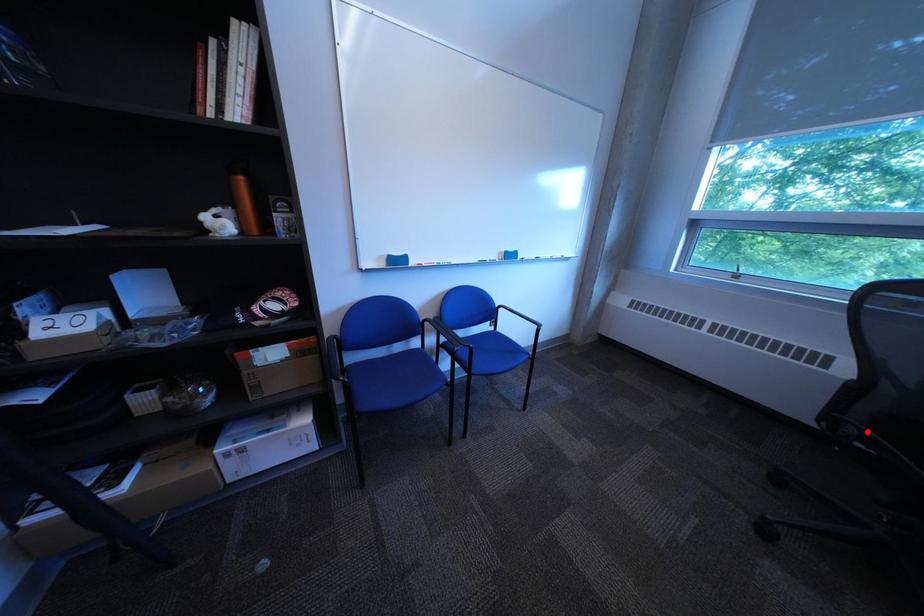
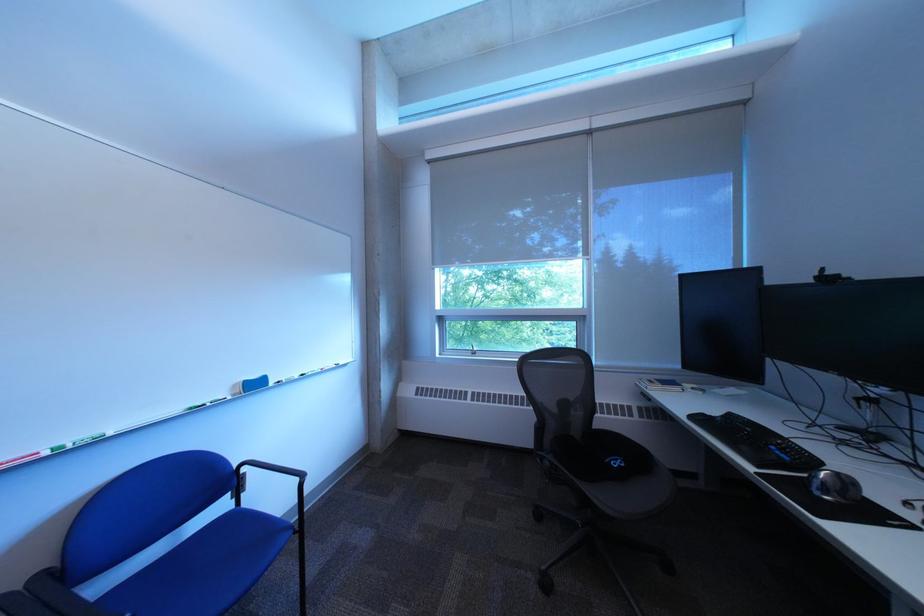
The point at the highlighted location is marked in the first image. Where is the corresponding point in the second image?

(563, 464)